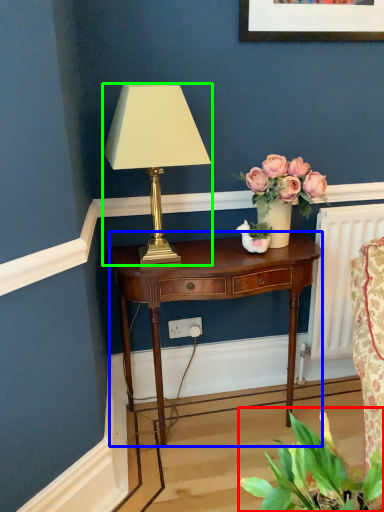
Question: Which object is positioned closest to houseplant (highlighted by a red box)? Select from nightstand (highlighted by a blue box) and lamp (highlighted by a green box).

Choices:
 (A) nightstand
 (B) lamp

Answer: (A)